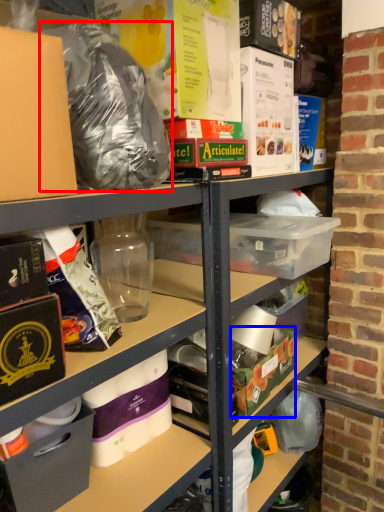
Question: Which of the following is the closest to the observer, waste (highlighted by a red box) or box (highlighted by a blue box)?

Choices:
 (A) waste
 (B) box

Answer: (A)